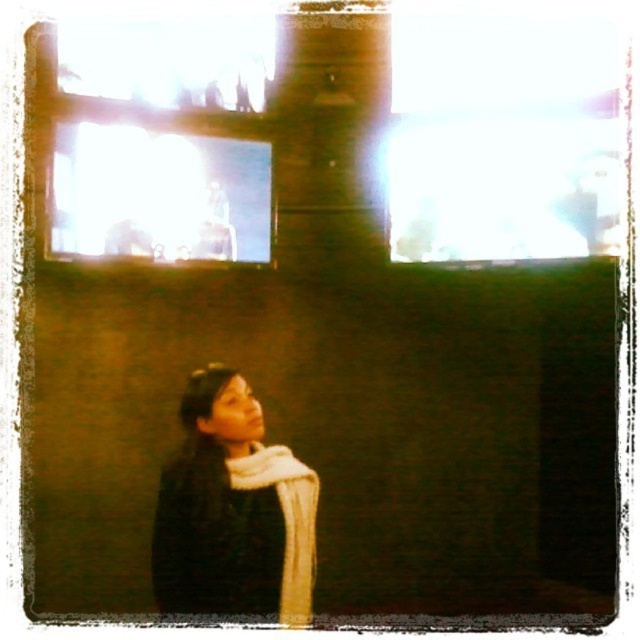
You are standing in the room and want to touch both the dark gray sweater at lower left and the transparent glass window at upper left. Which object will you reach first?

You will reach the dark gray sweater at lower left first because it is closer to you than the transparent glass window at upper left.

From the picture: You are standing in a dimly lit room with a rustic aesthetic. You see a dark gray sweater at lower left. Where exactly is the dark gray sweater located in the room?

The dark gray sweater at lower left is located at point (232, 509).

You are standing in a dimly lit room and want to move closer to the transparent glass window at upper left without stepping on the dark gray sweater at lower left. Which direction should you move?

You should move to the left because the dark gray sweater at lower left is to the right of the transparent glass window at upper left, so moving left would take you away from the sweater and closer to the window.